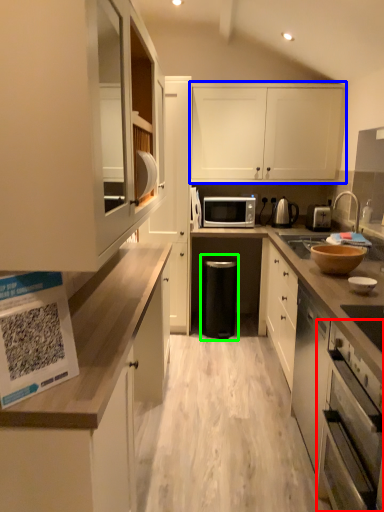
Question: Which object is the farthest from oven (highlighted by a red box)? Choose among these: cabinetry (highlighted by a blue box) or dish washer (highlighted by a green box).

Choices:
 (A) cabinetry
 (B) dish washer

Answer: (A)